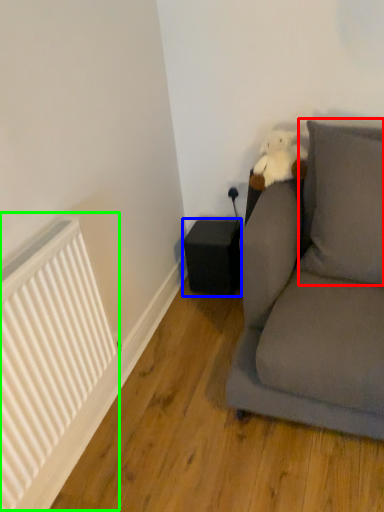
Question: Which object is positioned closest to pillow (highlighted by a red box)? Select from speaker (highlighted by a blue box) and radiator (highlighted by a green box).

Choices:
 (A) speaker
 (B) radiator

Answer: (A)